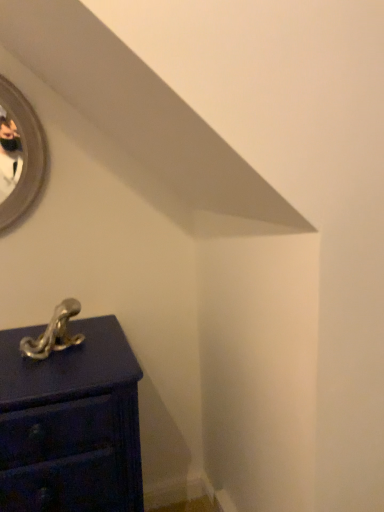
Locate an element on the screen. This screenshot has width=384, height=512. free space to the left of polished silver hook at lower left is located at coordinates (9, 347).